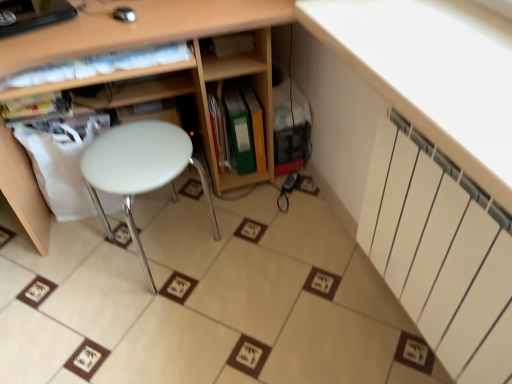
Where is `white plastic stool at center`? The height and width of the screenshot is (384, 512). white plastic stool at center is located at coordinates pos(140,170).

What is the approximate width of white glossy radiator at upper right?

15.42 inches.

Describe the element at coordinates (431, 69) in the screenshot. The width and height of the screenshot is (512, 384). I see `white glossy radiator at upper right` at that location.

How much space does green matte folder at center, positioned as the second book in left-to-right order, occupy horizontally?

The width of green matte folder at center, positioned as the second book in left-to-right order, is 25.83 centimeters.

Describe the element at coordinates (38, 105) in the screenshot. I see `matte white book at upper left, the third book when ordered from right to left` at that location.

Locate an element on the screen. This screenshot has width=512, height=384. green matte folder at center, the third book from the left is located at coordinates (238, 128).

Looking at their sizes, would you say green matte folder at center, which appears as the 2th book when viewed from the right, is wider or thinner than green matte folder at center, the third book from the left?

In the image, green matte folder at center, which appears as the 2th book when viewed from the right, appears to be wider than green matte folder at center, the third book from the left.

Can we say green matte folder at center, which appears as the 2th book when viewed from the right, lies outside green matte folder at center, positioned as the first book in right-to-left order?

Yes, green matte folder at center, which appears as the 2th book when viewed from the right, is located beyond the bounds of green matte folder at center, positioned as the first book in right-to-left order.

Is green matte folder at center, which appears as the 2th book when viewed from the right, oriented towards green matte folder at center, positioned as the first book in right-to-left order?

No, green matte folder at center, which appears as the 2th book when viewed from the right, does not turn towards green matte folder at center, positioned as the first book in right-to-left order.

Is there a large distance between green matte folder at center, positioned as the second book in left-to-right order, and green matte folder at center, the third book from the left?

No, there isn't a large distance between green matte folder at center, positioned as the second book in left-to-right order, and green matte folder at center, the third book from the left.

Is green matte folder at center, positioned as the first book in right-to-left order, outside of white matte radiator at upper right?

Yes, green matte folder at center, positioned as the first book in right-to-left order, is located beyond the bounds of white matte radiator at upper right.

Based on the photo, considering the relative sizes of green matte folder at center, positioned as the first book in right-to-left order, and white matte radiator at upper right in the image provided, is green matte folder at center, positioned as the first book in right-to-left order, thinner than white matte radiator at upper right?

No.

Which object is closer to the camera, green matte folder at center, the third book from the left, or white matte radiator at upper right?

Positioned in front is white matte radiator at upper right.

Image resolution: width=512 pixels, height=384 pixels. Identify the location of book that is the 3rd one when counting backward from the white matte radiator at upper right. (238, 128).

Which point is more distant from viewer, (397, 277) or (233, 96)?

The point (233, 96) is farther from the camera.

Considering the relative sizes of white matte radiator at upper right and green matte folder at center, the third book from the left, in the image provided, is white matte radiator at upper right bigger than green matte folder at center, the third book from the left,?

Yes.

Is there a large distance between white matte radiator at upper right and green matte folder at center, the third book from the left?

No, white matte radiator at upper right is in close proximity to green matte folder at center, the third book from the left.

Is wooden at center facing towards matte white book at upper left, the third book when ordered from right to left?

No, wooden at center is not aimed at matte white book at upper left, the third book when ordered from right to left.

Measure the distance between wooden at center and matte white book at upper left, the third book when ordered from right to left.

wooden at center is 15.24 inches away from matte white book at upper left, the third book when ordered from right to left.

Is wooden at center wider or thinner than matte white book at upper left, the third book when ordered from right to left?

In the image, wooden at center appears to be wider than matte white book at upper left, the third book when ordered from right to left.

How many degrees apart are the facing directions of wooden at center and matte white book at upper left, the third book when ordered from right to left?

wooden at center and matte white book at upper left, the third book when ordered from right to left, are facing 2.15 degrees away from each other.

Find the location of a particular element. shelf lying above the white glossy radiator at upper right (from the image's perspective) is located at coordinates (138, 27).

Is white glossy radiator at upper right inside or outside of wooden at center?

white glossy radiator at upper right is not enclosed by wooden at center.

Between white glossy radiator at upper right and wooden at center, which one is positioned behind?

wooden at center is further away from the camera.

Is point (352, 47) less distant than point (140, 39)?

That is True.

Between point (211, 96) and point (410, 278), which one is positioned behind?

The point (211, 96) is farther from the camera.

Considering the sizes of green matte folder at center, positioned as the second book in left-to-right order, and white matte radiator at upper right in the image, is green matte folder at center, positioned as the second book in left-to-right order, taller or shorter than white matte radiator at upper right?

Clearly, green matte folder at center, positioned as the second book in left-to-right order, is shorter compared to white matte radiator at upper right.

From the image's perspective, between green matte folder at center, which appears as the 2th book when viewed from the right, and white matte radiator at upper right, who is located below?

From the image's view, white matte radiator at upper right is below.

Is green matte folder at center, positioned as the second book in left-to-right order, to the left of white matte radiator at upper right from the viewer's perspective?

Yes.

Would you say white matte radiator at upper right is part of white glossy radiator at upper right's contents?

No, white glossy radiator at upper right does not contain white matte radiator at upper right.

From a real-world perspective, which object stands above the other?

white glossy radiator at upper right, from a real-world perspective.

From the image's perspective, is white glossy radiator at upper right above white matte radiator at upper right?

Yes, from the image's perspective, white glossy radiator at upper right is over white matte radiator at upper right.

Which is in front, point (421, 62) or point (489, 217)?

The point (489, 217) is in front.

Identify the location of book that is the 1st object above the green matte folder at center, the third book from the left (from a real-world perspective). (219, 131).

From the white matte radiator at upper right, count the 1st book to the left and point to it. Please provide its 2D coordinates.

[(238, 128)]

From the image, which object appears to be farther from white matte radiator at upper right, white glossy radiator at upper right or wooden at center?

wooden at center is positioned further to the anchor white matte radiator at upper right.

Looking at this image, from the image, which object appears to be farther from white glossy radiator at upper right, white matte radiator at upper right or green matte folder at center, positioned as the first book in right-to-left order?

green matte folder at center, positioned as the first book in right-to-left order, lies further to white glossy radiator at upper right than the other object.

Estimate the real-world distances between objects in this image. Which object is further from white plastic stool at center, green matte folder at center, the third book from the left, or matte white book at upper left, the first book from the left?

green matte folder at center, the third book from the left, is further to white plastic stool at center.

Considering their positions, is wooden at center positioned further to white matte radiator at upper right than matte white book at upper left, the third book when ordered from right to left?

matte white book at upper left, the third book when ordered from right to left.

Looking at the image, which one is located further to white plastic stool at center, green matte folder at center, positioned as the first book in right-to-left order, or wooden at center?

green matte folder at center, positioned as the first book in right-to-left order, is further to white plastic stool at center.

Considering their positions, is white matte radiator at upper right positioned closer to green matte folder at center, the third book from the left, than green matte folder at center, positioned as the second book in left-to-right order?

green matte folder at center, positioned as the second book in left-to-right order, lies closer to green matte folder at center, the third book from the left, than the other object.

Which object lies nearer to the anchor point white plastic stool at center, matte white book at upper left, the third book when ordered from right to left, or white glossy radiator at upper right?

matte white book at upper left, the third book when ordered from right to left, lies closer to white plastic stool at center than the other object.

Which object lies further to the anchor point white glossy radiator at upper right, wooden at center or white plastic stool at center?

white plastic stool at center lies further to white glossy radiator at upper right than the other object.

Find the location of a particular element. This screenshot has height=384, width=512. stool between matte white book at upper left, the third book when ordered from right to left, and green matte folder at center, positioned as the second book in left-to-right order, from left to right is located at coordinates (140, 170).

At what (x,y) coordinates should I click in order to perform the action: click on stool situated between matte white book at upper left, the third book when ordered from right to left, and white matte radiator at upper right from left to right. Please return your answer as a coordinate pair (x, y). The height and width of the screenshot is (384, 512). Looking at the image, I should click on pos(140,170).

At what (x,y) coordinates should I click in order to perform the action: click on stool situated between wooden at center and white matte radiator at upper right from left to right. Please return your answer as a coordinate pair (x, y). This screenshot has height=384, width=512. Looking at the image, I should click on (140, 170).

The image size is (512, 384). What are the coordinates of `stool situated between matte white book at upper left, the first book from the left, and green matte folder at center, positioned as the first book in right-to-left order, from left to right` in the screenshot? It's located at (140, 170).